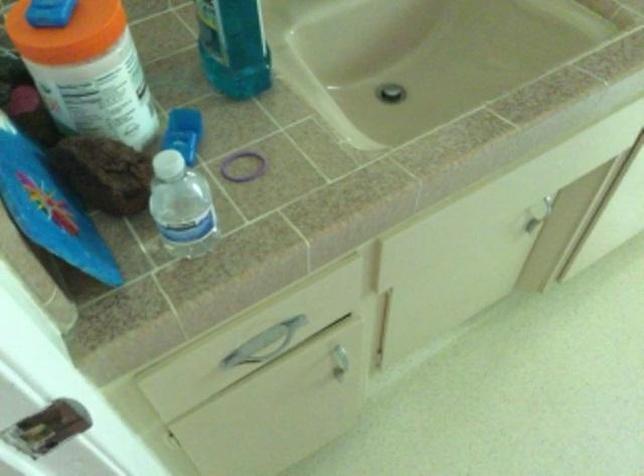
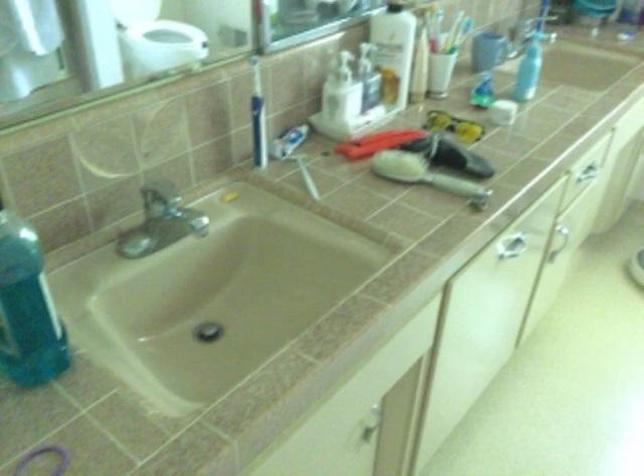
The images are taken continuously from a first-person perspective. In which direction are you moving?

The cameraman moved toward right, backward.